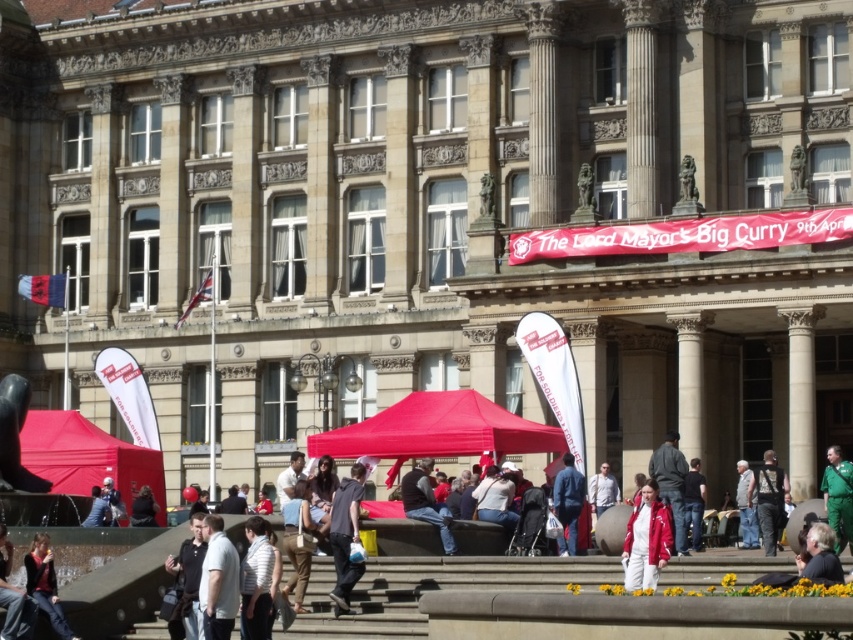
Between red jacket at center and denim jacket at lower left, which one has less height?

Standing shorter between the two is denim jacket at lower left.

Who is more distant from viewer, (677, 492) or (97, 518)?

The point (677, 492) is behind.

Which is behind, point (672, 516) or point (103, 509)?

The point (103, 509) is behind.

At what (x,y) coordinates should I click in order to perform the action: click on red jacket at center. Please return your answer as a coordinate pair (x, y). The width and height of the screenshot is (853, 640). Looking at the image, I should click on (671, 483).

Is point (248, 577) closer to camera compared to point (155, 513)?

Yes.

Is white striped shirt at center above matte black jacket at lower left?

Yes, white striped shirt at center is above matte black jacket at lower left.

Is point (241, 628) positioned after point (148, 492)?

No, (241, 628) is in front of (148, 492).

The height and width of the screenshot is (640, 853). I want to click on white striped shirt at center, so click(256, 580).

Based on the photo, how far apart are red matte jacket at center and white striped shirt at center?

red matte jacket at center and white striped shirt at center are 7.92 meters apart from each other.

Which of these two, red matte jacket at center or white striped shirt at center, stands taller?

white striped shirt at center is taller.

You are a GUI agent. You are given a task and a screenshot of the screen. Output one action in this format:
    pyautogui.click(x=<x>, y=<y>)
    Task: Click on the red matte jacket at center
    The width and height of the screenshot is (853, 640).
    Given the screenshot: What is the action you would take?
    [646, 540]

Locate an element on the screen. The image size is (853, 640). red matte jacket at center is located at coordinates (646, 540).